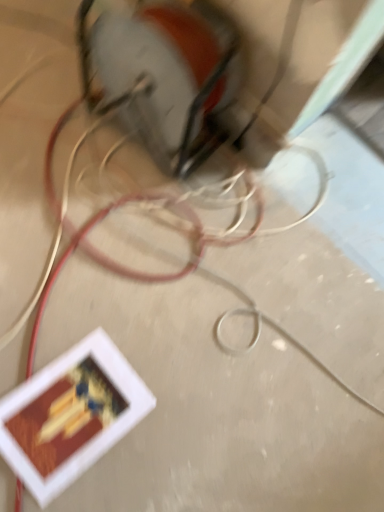
Question: Considering the relative positions of matte red wire at lower left and metallic silver power plugs and sockets at upper center in the image provided, is matte red wire at lower left to the left of metallic silver power plugs and sockets at upper center from the viewer's perspective?

Choices:
 (A) no
 (B) yes

Answer: (A)

Question: Is matte red wire at lower left further to the viewer compared to metallic silver power plugs and sockets at upper center?

Choices:
 (A) yes
 (B) no

Answer: (B)

Question: Is matte red wire at lower left positioned beyond the bounds of metallic silver power plugs and sockets at upper center?

Choices:
 (A) yes
 (B) no

Answer: (A)

Question: Can you confirm if matte red wire at lower left is thinner than metallic silver power plugs and sockets at upper center?

Choices:
 (A) no
 (B) yes

Answer: (A)

Question: From a real-world perspective, is matte red wire at lower left physically above metallic silver power plugs and sockets at upper center?

Choices:
 (A) no
 (B) yes

Answer: (A)

Question: From a real-world perspective, is matte red wire at lower left positioned under metallic silver power plugs and sockets at upper center based on gravity?

Choices:
 (A) yes
 (B) no

Answer: (A)

Question: Is matte red wire at lower left surrounded by metallic silver power plugs and sockets at upper center?

Choices:
 (A) yes
 (B) no

Answer: (B)

Question: Considering the relative sizes of metallic silver power plugs and sockets at upper center and matte red wire at lower left in the image provided, is metallic silver power plugs and sockets at upper center smaller than matte red wire at lower left?

Choices:
 (A) yes
 (B) no

Answer: (A)

Question: Is metallic silver power plugs and sockets at upper center outside matte red wire at lower left?

Choices:
 (A) yes
 (B) no

Answer: (A)

Question: Is metallic silver power plugs and sockets at upper center shorter than matte red wire at lower left?

Choices:
 (A) yes
 (B) no

Answer: (B)

Question: Is the depth of metallic silver power plugs and sockets at upper center greater than that of matte red wire at lower left?

Choices:
 (A) no
 (B) yes

Answer: (B)

Question: From the image's perspective, does metallic silver power plugs and sockets at upper center appear lower than matte red wire at lower left?

Choices:
 (A) yes
 (B) no

Answer: (B)

Question: From the image's perspective, is matte red wire at lower left positioned above or below metallic silver power plugs and sockets at upper center?

Choices:
 (A) below
 (B) above

Answer: (A)